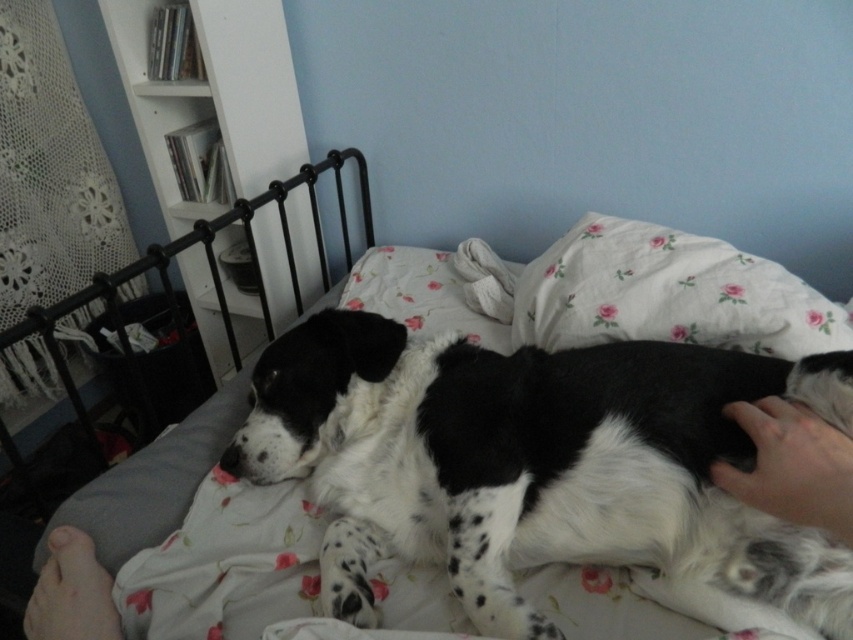
You are trying to decide whether to place a new decorative item on the bed. The item is 40 cm wide. Based on the image, can the spotted fur dog at center and the fluffy white pillow at upper right fit side by side on the bed without overlapping?

The spotted fur dog at center is wider than the fluffy white pillow at upper right. Since the dog is larger, there might be enough space for both items if the bed is sufficiently wide. However, without knowing the exact dimensions of the bed, it is difficult to determine definitively. Consider measuring the bed first.

Looking at this image, you are a robotic vacuum cleaner with a 12 inch diameter. You are currently positioned near the spotted fur dog at center and want to move towards the fluffy white pillow at upper right. Can you navigate directly between them without any obstruction?

The distance between the spotted fur dog at center and the fluffy white pillow at upper right is 12.38 inches. Since the robotic vacuum cleaner has a 12 inch diameter, it can fit through the space between them as the distance is slightly larger than the vacuum cleaner.

You are holding a camera and want to take a photo of the spotted fur dog at center. If your camera has a minimum focusing distance of 24 inches, will you need to move closer or farther away to ensure the dog is in focus?

The distance between the spotted fur dog at center and the camera is 26.67 inches. Since the minimum focusing distance is 24 inches, you can move closer to the dog to ensure it is in focus as long as you don not go below 24 inches.